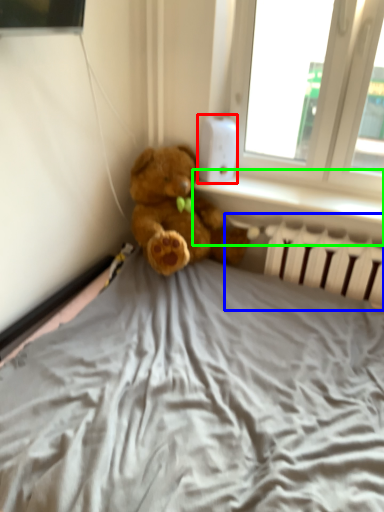
Question: Which is farther away from thermostat (highlighted by a red box)? radiator (highlighted by a blue box) or window sill (highlighted by a green box)?

Choices:
 (A) radiator
 (B) window sill

Answer: (A)